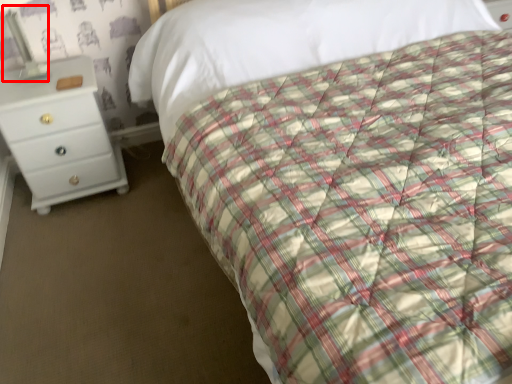
Question: From the image's perspective, considering the relative positions of bedside lamp (annotated by the red box) and chest of drawers in the image provided, where is bedside lamp (annotated by the red box) located with respect to the staircase?

Choices:
 (A) below
 (B) above

Answer: (B)